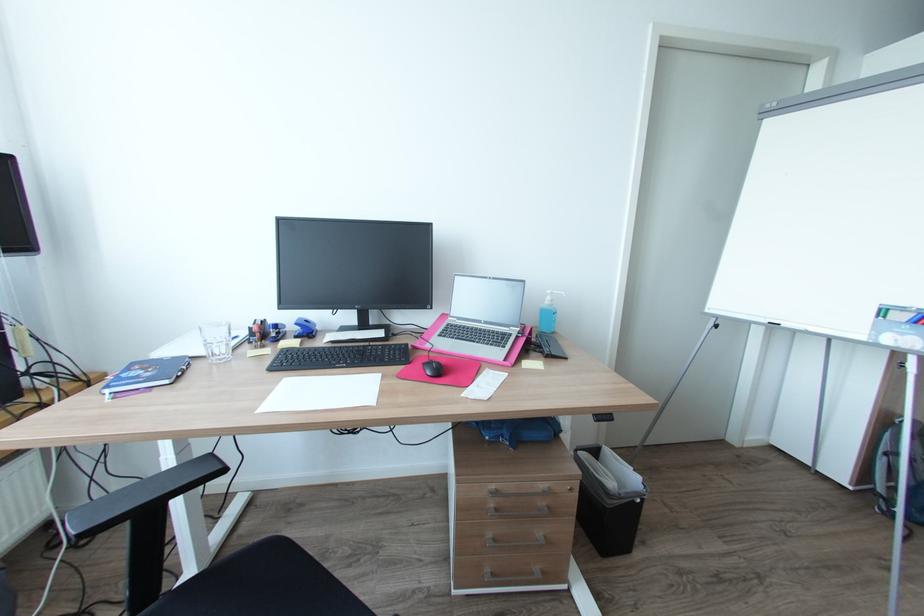
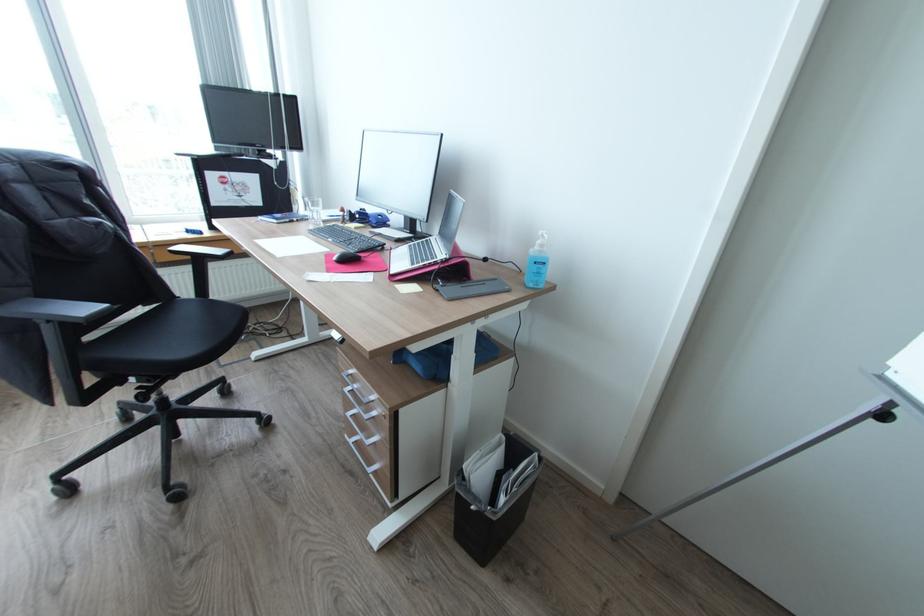
In the second image, find the point that corresponds to the point at 556,300 in the first image.

(545, 245)